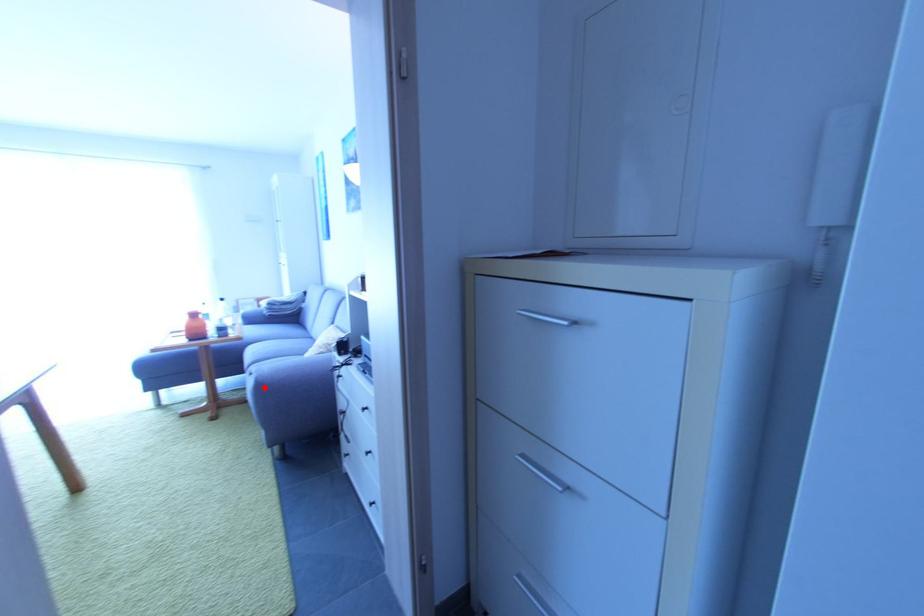
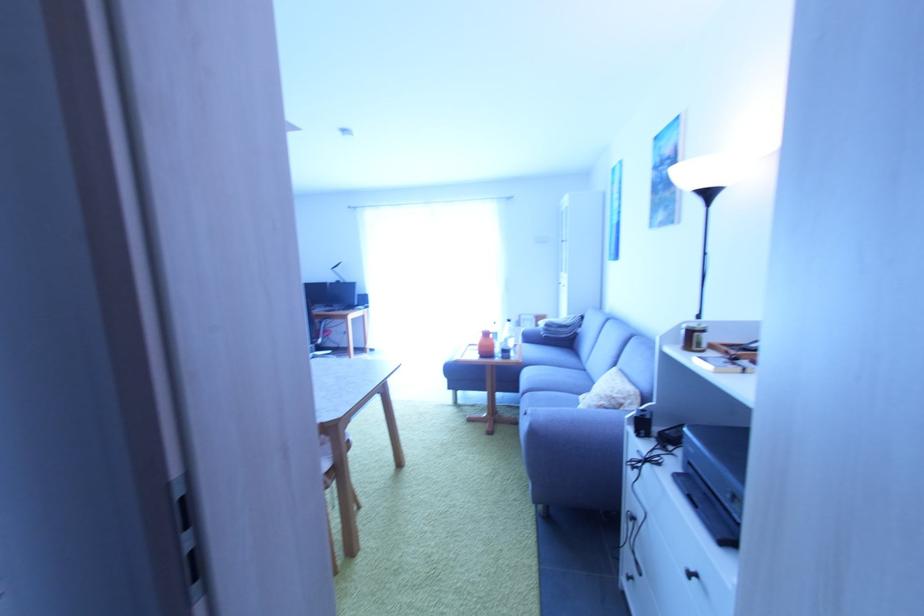
Where in the second image is the point corresponding to the highlighted location from the first image?

(538, 435)